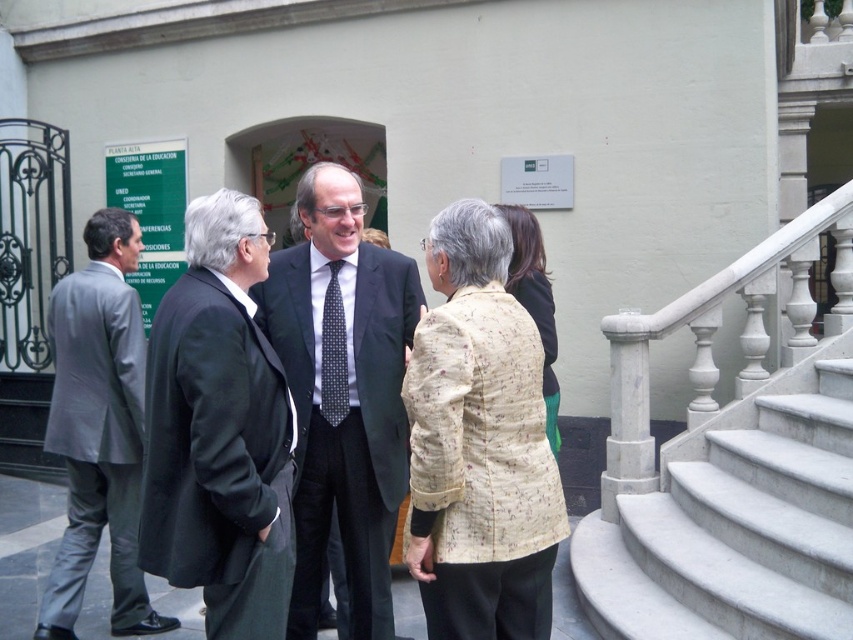
Between dark gray suit at center and black dotted tie at center, which one has less height?

With less height is black dotted tie at center.

Is dark gray suit at center to the left of black dotted tie at center from the viewer's perspective?

No, dark gray suit at center is not to the left of black dotted tie at center.

You are a GUI agent. You are given a task and a screenshot of the screen. Output one action in this format:
    pyautogui.click(x=<x>, y=<y>)
    Task: Click on the dark gray suit at center
    
    Given the screenshot: What is the action you would take?
    pyautogui.click(x=341, y=394)

Locate an element on the screen. dark gray suit at center is located at coordinates (341, 394).

Between point (741, 451) and point (467, 611), which one is positioned in front?

Point (467, 611) is more forward.

Which is above, white marble stairs at lower right or printed fabric jacket at center?

printed fabric jacket at center

Which is behind, point (747, 492) or point (490, 572)?

Positioned behind is point (747, 492).

Where is `white marble stairs at lower right`? white marble stairs at lower right is located at coordinates (737, 522).

Is printed fabric jacket at center to the left of black wool coat at center from the viewer's perspective?

Incorrect, printed fabric jacket at center is not on the left side of black wool coat at center.

Between point (453, 278) and point (178, 515), which one is positioned in front?

Positioned in front is point (178, 515).

Where is `printed fabric jacket at center`? This screenshot has height=640, width=853. printed fabric jacket at center is located at coordinates coord(479,442).